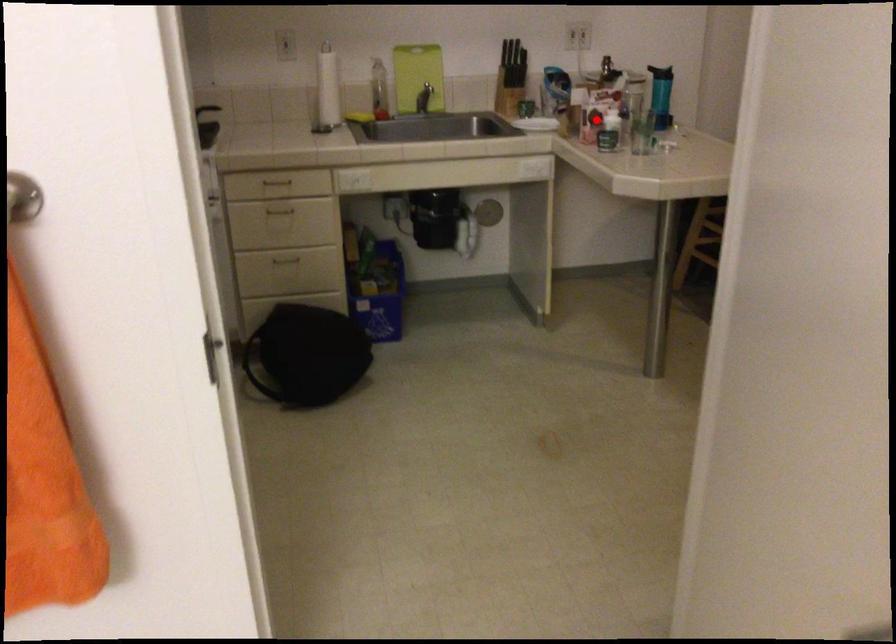
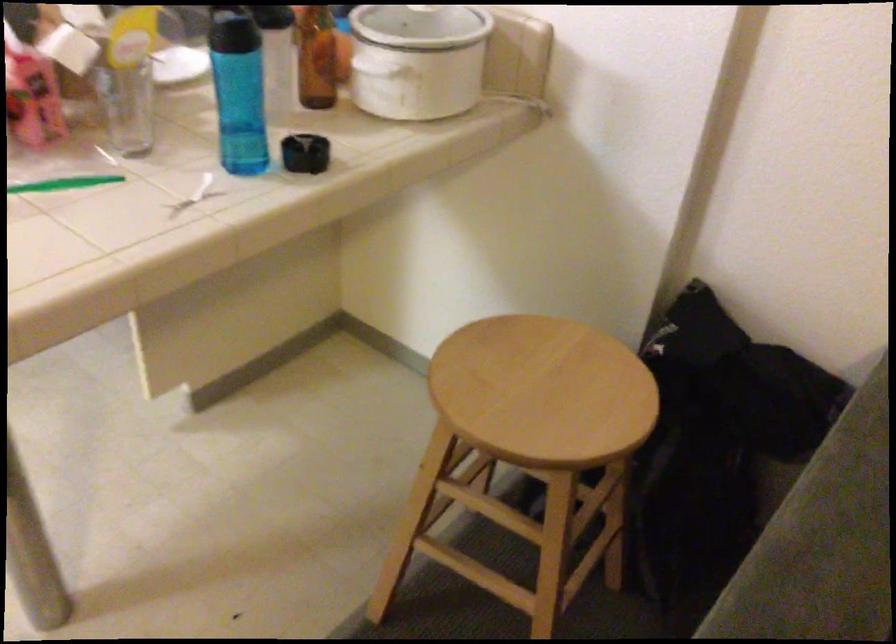
Locate, in the second image, the point that corresponds to the highlighted location in the first image.

(127, 106)